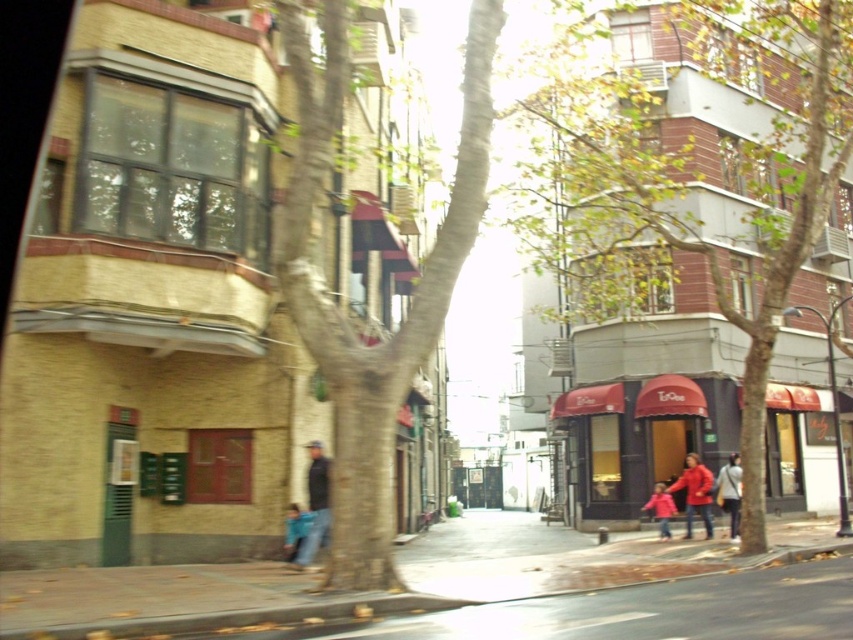
Is smooth brown tree trunk at center smaller than smooth concrete sidewalk at center?

Indeed, smooth brown tree trunk at center has a smaller size compared to smooth concrete sidewalk at center.

Which is more to the left, smooth brown tree trunk at center or smooth concrete sidewalk at center?

smooth brown tree trunk at center is more to the left.

Which is in front, point (345, 42) or point (224, 582)?

Positioned in front is point (345, 42).

Find the location of a particular element. This screenshot has height=640, width=853. smooth brown tree trunk at center is located at coordinates [335, 307].

Describe the element at coordinates (375, 595) in the screenshot. Image resolution: width=853 pixels, height=640 pixels. I see `smooth concrete sidewalk at center` at that location.

Does point (650, 550) come closer to viewer compared to point (699, 490)?

Yes, it is.

Identify the location of smooth concrete sidewalk at center. The width and height of the screenshot is (853, 640). (375, 595).

How much distance is there between smooth brown tree trunk at center and white cotton jacket at lower right?

The distance of smooth brown tree trunk at center from white cotton jacket at lower right is 9.34 meters.

Is smooth brown tree trunk at center wider than white cotton jacket at lower right?

Correct, the width of smooth brown tree trunk at center exceeds that of white cotton jacket at lower right.

Find the location of `smooth brown tree trunk at center`. smooth brown tree trunk at center is located at coordinates [335, 307].